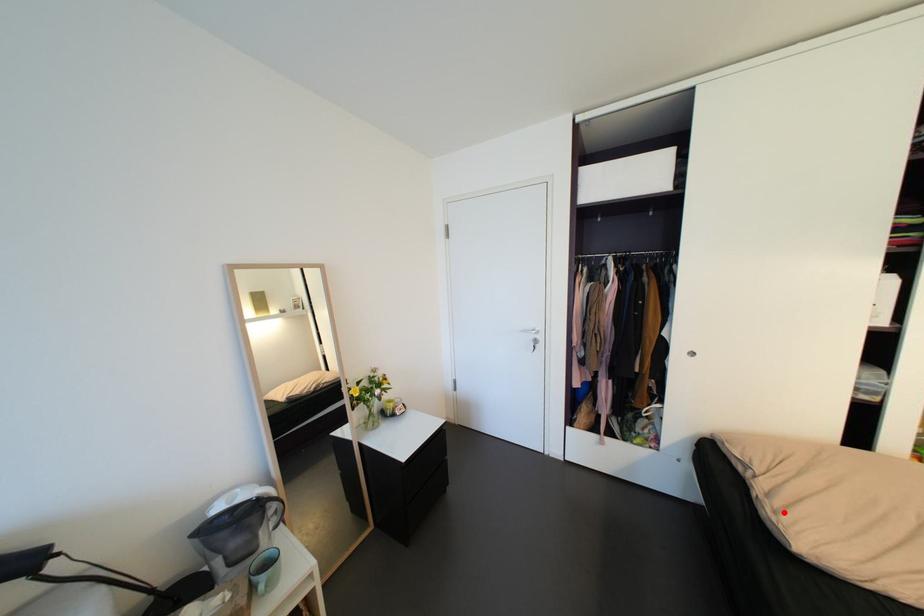
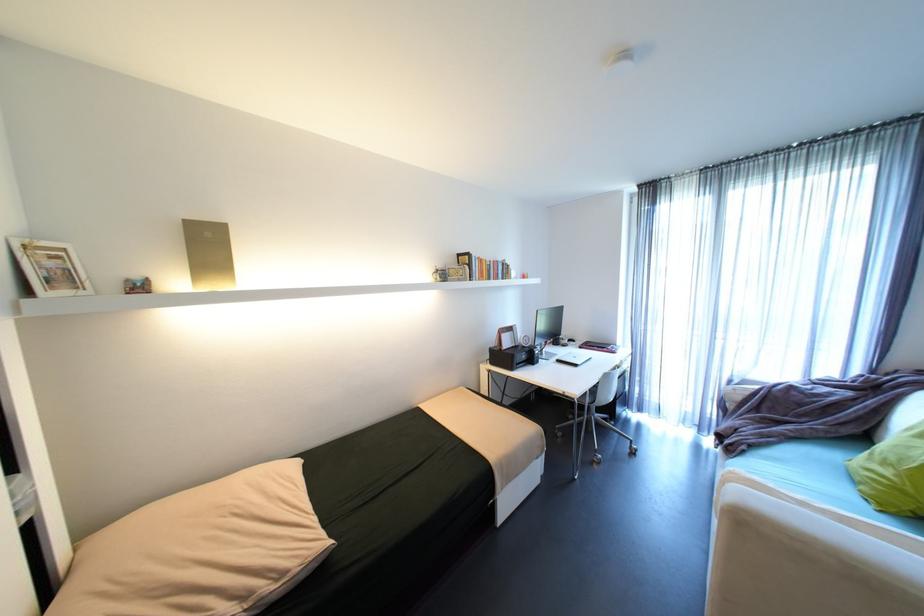
In the second image, find the point that corresponds to the highlighted location in the first image.

(289, 575)